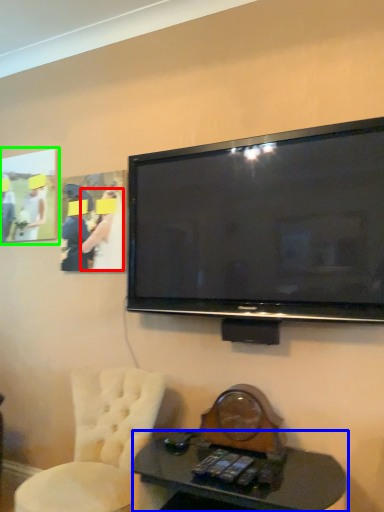
Question: Which object is positioned farthest from person (highlighted by a red box)? Select from desk (highlighted by a blue box) and picture frame (highlighted by a green box).

Choices:
 (A) desk
 (B) picture frame

Answer: (A)